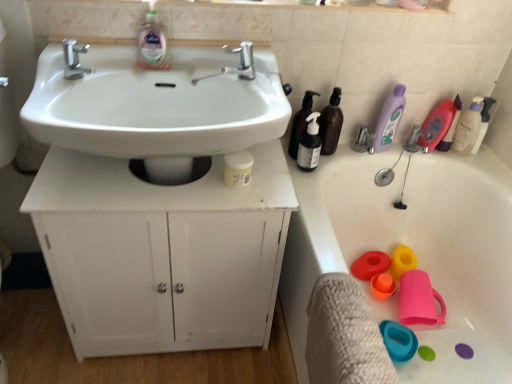
Image resolution: width=512 pixels, height=384 pixels. I want to click on vacant space situated above textured white towel at lower right (from a real-world perspective), so click(x=352, y=321).